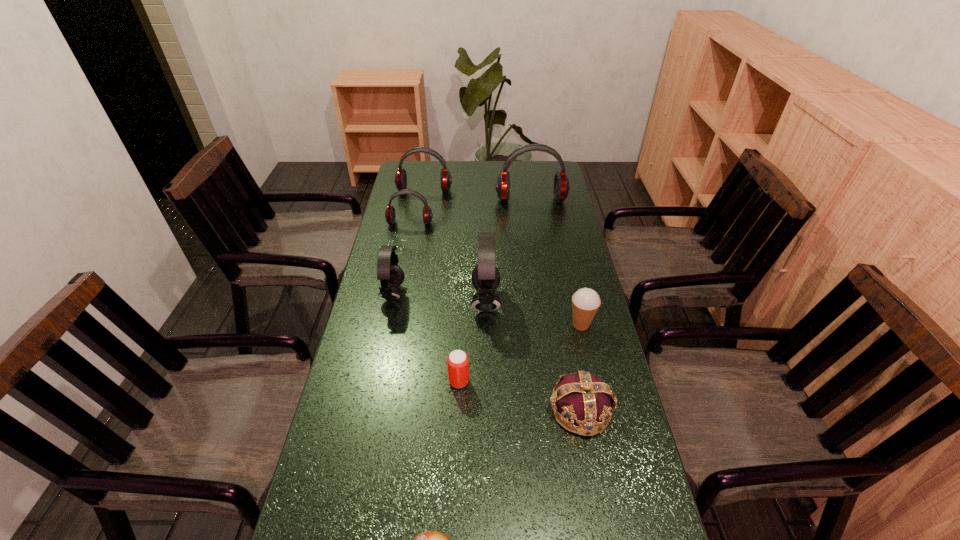
At what (x,y) coordinates should I click in order to perform the action: click on vacant space situated on the ear cups of the bigger black earphone. Please return your answer as a coordinate pair (x, y). Looking at the image, I should click on (443, 301).

The width and height of the screenshot is (960, 540). I want to click on vacant position located on the ear cups of the bigger black earphone, so click(405, 301).

What are the coordinates of `vacant space located 0.220m on the ear cups of the bigger black earphone` in the screenshot? It's located at (401, 301).

Identify the location of free space located on the ear cups of the second biggest red earphone. This screenshot has height=540, width=960. (420, 214).

What are the coordinates of `vacant space located 0.320m on the ear cups of the left black earphone` in the screenshot? It's located at (503, 294).

At what (x,y) coordinates should I click in order to perform the action: click on vacant space located 0.200m on the ear cups of the smallest red earphone. Please return your answer as a coordinate pair (x, y). Looking at the image, I should click on (402, 262).

The height and width of the screenshot is (540, 960). Identify the location of vacant space situated 0.150m on the front of the icecream. (593, 378).

Where is `free space located 0.080m on the left of the crown`? This screenshot has width=960, height=540. free space located 0.080m on the left of the crown is located at coordinates (516, 410).

Where is `vacant space located 0.270m on the back of the beer can`? The width and height of the screenshot is (960, 540). vacant space located 0.270m on the back of the beer can is located at coordinates (463, 302).

In order to click on object at the far edge in this screenshot , I will do `click(400, 179)`.